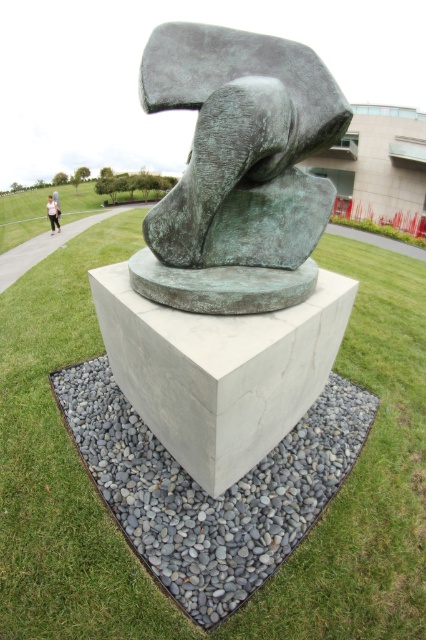
Who is positioned more to the right, green grass at center or light pink fabric at lower left?

From the viewer's perspective, green grass at center appears more on the right side.

Is green grass at center below light pink fabric at lower left?

Yes, green grass at center is below light pink fabric at lower left.

The height and width of the screenshot is (640, 426). Describe the element at coordinates (63, 467) in the screenshot. I see `green grass at center` at that location.

You are a GUI agent. You are given a task and a screenshot of the screen. Output one action in this format:
    pyautogui.click(x=<x>, y=<y>)
    Task: Click on the green grass at center
    
    Given the screenshot: What is the action you would take?
    pyautogui.click(x=63, y=467)

Consider the image. Is green grass at center wider than green patina stone sculpture at center?

Indeed, green grass at center has a greater width compared to green patina stone sculpture at center.

Does green grass at center appear under green patina stone sculpture at center?

Correct, green grass at center is located below green patina stone sculpture at center.

Does point (91, 557) lie in front of point (270, 268)?

Yes.

Where is `green grass at center`? This screenshot has height=640, width=426. green grass at center is located at coordinates (63, 467).

Identify the location of green patina stone sculpture at center. Image resolution: width=426 pixels, height=640 pixels. (238, 170).

Is green patina stone sculpture at center wider than gray concrete block at center?

No, green patina stone sculpture at center is not wider than gray concrete block at center.

Which is behind, point (181, 99) or point (255, 444)?

Positioned behind is point (255, 444).

This screenshot has width=426, height=640. Identify the location of green patina stone sculpture at center. (238, 170).